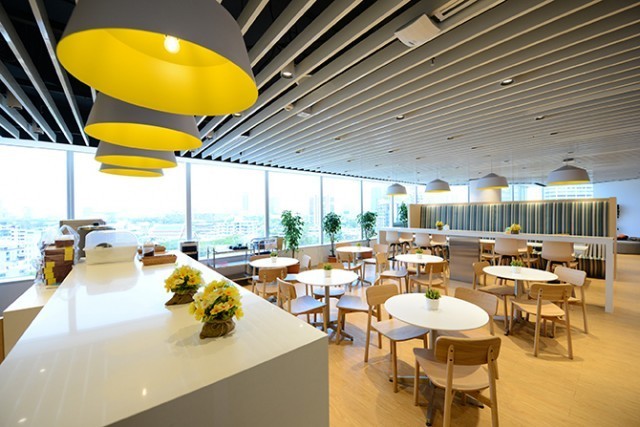
This screenshot has width=640, height=427. I want to click on stacked binders, so click(x=51, y=281), click(x=45, y=276), click(x=49, y=270), click(x=49, y=264), click(x=65, y=256), click(x=68, y=251).